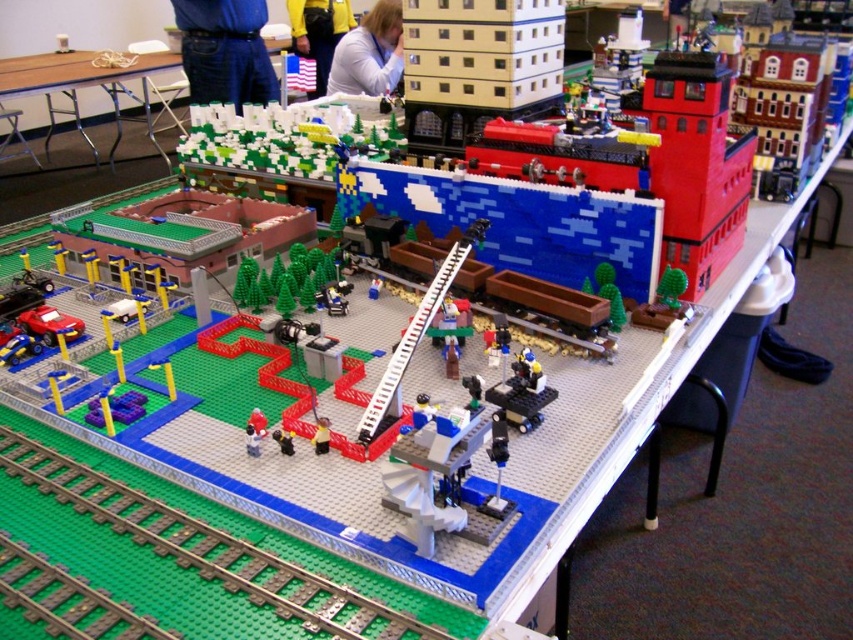
Question: Which object appears closest to the camera in this image?

Choices:
 (A) green plastic train track at bottom
 (B) yellow fabric shirt at upper center
 (C) white fabric shirt at upper center

Answer: (A)

Question: Does yellow fabric shirt at upper center come in front of smooth plastic toy at center?

Choices:
 (A) no
 (B) yes

Answer: (A)

Question: Which is farther from the blue denim pants at upper center?

Choices:
 (A) white fabric shirt at upper center
 (B) smooth plastic toy at center
 (C) yellow fabric shirt at upper center
 (D) green plastic train track at bottom

Answer: (B)

Question: Among these points, which one is nearest to the camera?

Choices:
 (A) (96, 76)
 (B) (296, 604)

Answer: (B)

Question: Is green matte trees at upper left behind yellow fabric shirt at upper center?

Choices:
 (A) yes
 (B) no

Answer: (B)

Question: Is green plastic train track at bottom behind green matte trees at upper left?

Choices:
 (A) yes
 (B) no

Answer: (B)